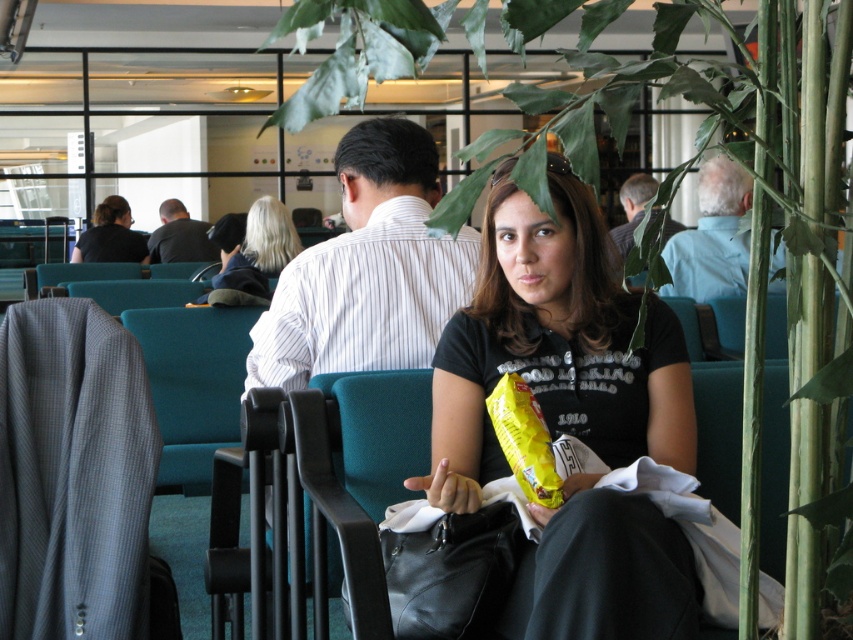
Looking at this image, you are a barista at the cafe and need to retrieve an item from the counter. You see the black leather bag at center and the gray fabric shirt at center. Which one is closer to the counter?

The black leather bag at center is below the gray fabric shirt at center, so it is closer to the counter.

You are a barista at the cafe and need to place a customer order. The customer has a black leather bag at center and a gray fabric shirt at center. Which item can you hand over first if you want to give the smaller item first?

The black leather bag at center is smaller than the gray fabric shirt at center, so you can hand over the black leather bag at center first.

You are a barista trying to deliver a drink to a customer. You see the black leather bag at center and the gray fabric shirt at center. Which one is closer to you?

The black leather bag at center and gray fabric shirt at center are 3.50 meters apart, so you need to determine which one is closer based on their positions. However, the description only provides the distance between them, not their individual distances from you. Without additional information about their exact locations relative to your position, it is impossible to determine which is closer.